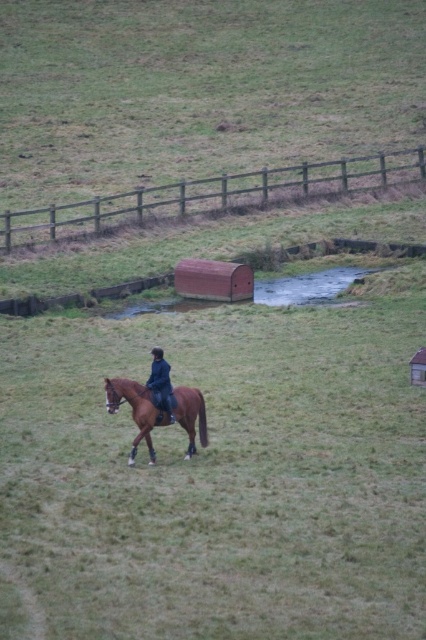
Question: Which of these objects is positioned closest to the brown glossy horse at lower center?

Choices:
 (A) dark blue leather jacket at center
 (B) brown wooden fence at upper center
 (C) green grassy field at center

Answer: (A)

Question: Which object is positioned closest to the brown wooden fence at upper center?

Choices:
 (A) brown glossy horse at lower center
 (B) dark blue leather jacket at center

Answer: (A)

Question: Which point appears farthest from the camera in this image?

Choices:
 (A) (164, 365)
 (B) (265, 32)
 (C) (175, 417)

Answer: (B)

Question: Is green grassy field at center positioned at the back of brown wooden fence at upper center?

Choices:
 (A) no
 (B) yes

Answer: (B)

Question: Does green grassy field at center lie in front of brown wooden fence at upper center?

Choices:
 (A) no
 (B) yes

Answer: (A)

Question: Does brown glossy horse at lower center appear over dark blue leather jacket at center?

Choices:
 (A) yes
 (B) no

Answer: (B)